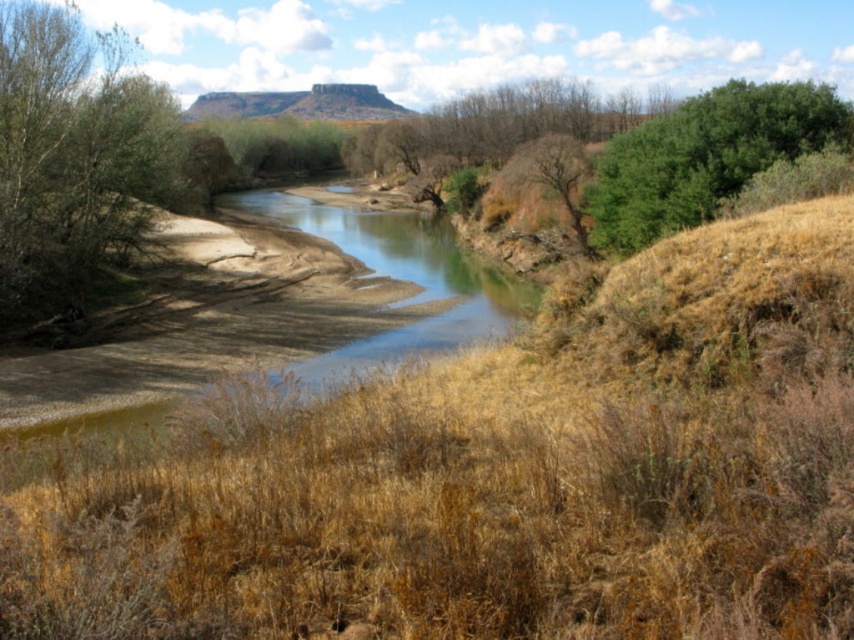
You are a hiker who needs to cross the river. You see the brown dry grass at center and the green leafy tree at left. Which object is taller, and how might that affect your path?

The green leafy tree at left is taller than the brown dry grass at center. Since the tree is taller, it might provide shade or a landmark to guide your path, but the dry grass area could be a flatter or more stable crossing point.

Looking at this image, you are a hiker trying to cross the river. You notice brown dry grass at center and green leafy tree at left in your path. Which one is wider from your perspective?

The brown dry grass at center is wider than the green leafy tree at left.